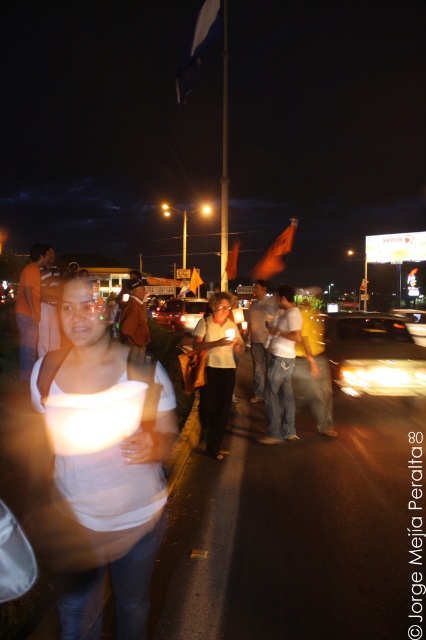
Describe the element at coordinates (313, 372) in the screenshot. I see `yellow fabric shirt at center` at that location.

Does yellow fabric shirt at center have a smaller size compared to matte white shirt at center?

Yes.

Between point (319, 332) and point (34, 253), which one is positioned behind?

The point (319, 332) is behind.

At what (x,y) coordinates should I click in order to perform the action: click on yellow fabric shirt at center. Please return your answer as a coordinate pair (x, y). This screenshot has height=640, width=426. Looking at the image, I should click on (313, 372).

Does white matte shirt at center have a lesser width compared to light brown leather jacket at center?

No, white matte shirt at center is not thinner than light brown leather jacket at center.

Who is more forward, (221,384) or (261,337)?

Point (221,384)

Which is in front, point (218, 301) or point (264, 368)?

Point (218, 301) is in front.

This screenshot has height=640, width=426. In order to click on white matte shirt at center in this screenshot , I will do `click(216, 371)`.

This screenshot has width=426, height=640. What do you see at coordinates (103, 467) in the screenshot?
I see `white matte lantern at center` at bounding box center [103, 467].

Is white matte lantern at center wider than light brown leather jacket at center?

Indeed, white matte lantern at center has a greater width compared to light brown leather jacket at center.

Where is `white matte lantern at center`? white matte lantern at center is located at coordinates (103, 467).